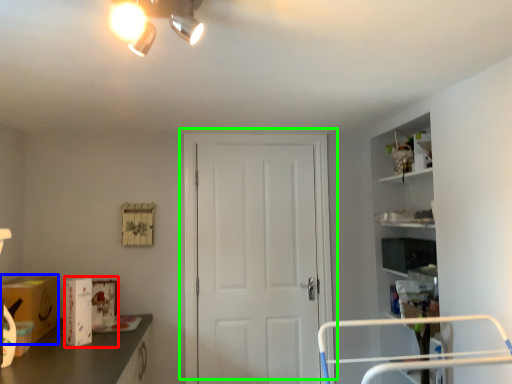
Question: Based on their relative distances, which object is nearer to box (highlighted by a red box)? Choose from cardboard box (highlighted by a blue box) and door (highlighted by a green box).

Choices:
 (A) cardboard box
 (B) door

Answer: (A)